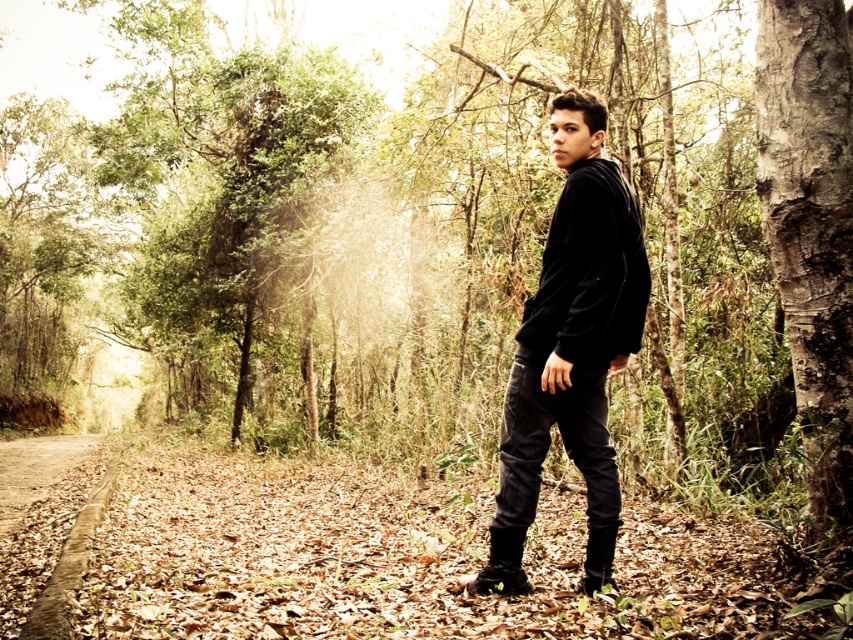
Question: Is brown dirt path at lower left closer to camera compared to leather boots at lower center?

Choices:
 (A) no
 (B) yes

Answer: (B)

Question: Which point is farther from the camera taking this photo?

Choices:
 (A) (33, 566)
 (B) (488, 557)
 (C) (579, 356)
 (D) (838, 310)

Answer: (A)

Question: Is smooth bark tree at right to the left of black suede boot at lower center from the viewer's perspective?

Choices:
 (A) yes
 (B) no

Answer: (B)

Question: Among these objects, which one is nearest to the camera?

Choices:
 (A) brown dirt path at lower left
 (B) black suede boot at lower center
 (C) leather boots at lower center
 (D) black velvet hoodie at center

Answer: (A)

Question: Which of the following is the closest to the observer?

Choices:
 (A) (103, 456)
 (B) (830, 353)
 (C) (619, 195)
 (D) (497, 589)

Answer: (B)

Question: Is black velvet hoodie at center to the left of black suede boot at lower center from the viewer's perspective?

Choices:
 (A) no
 (B) yes

Answer: (B)